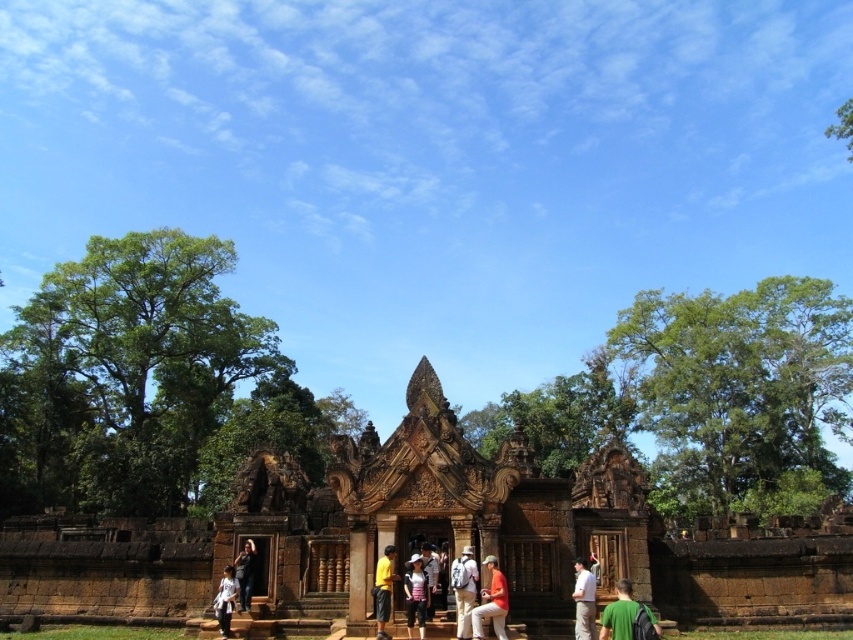
You are a tourist visiting the ancient temple and want to place your backpack on the ground near the center. The temple map shows that the entrance is located at coordinate point 0.922, 0.545. Is the white fabric backpack at center currently blocking the entrance?

The white fabric backpack at center is positioned at point (463,589), which matches the entrance coordinates, so yes, the backpack is blocking the entrance.

You are a hiker who has just arrived at this ancient temple site. You need to retrieve your dark brown leather jacket at lower center from your white fabric backpack at center. Can you reach it without moving the backpack?

The distance between the white fabric backpack at center and the dark brown leather jacket at lower center is 53.67 feet, so you cannot reach the jacket without moving the backpack since they are not close enough.